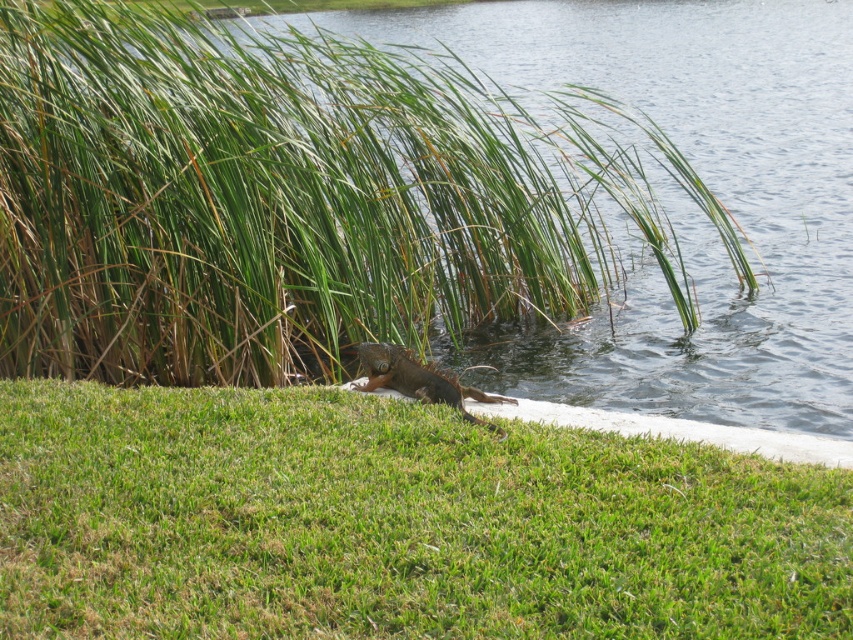
Question: Which point is farther to the camera?

Choices:
 (A) brown scaly lizard at center
 (B) clear water at grass right
 (C) green grassy at lower center

Answer: (B)

Question: Which object is closer to the camera taking this photo?

Choices:
 (A) clear water at grass right
 (B) brown scaly lizard at center

Answer: (B)

Question: Is clear water at grass right to the left of brown scaly lizard at center from the viewer's perspective?

Choices:
 (A) no
 (B) yes

Answer: (A)

Question: Which point is farther to the camera?

Choices:
 (A) green grassy at lower center
 (B) brown scaly lizard at center

Answer: (B)

Question: Can you confirm if clear water at grass right is wider than green grassy at lower center?

Choices:
 (A) no
 (B) yes

Answer: (B)

Question: Can you confirm if clear water at grass right is positioned to the left of brown scaly lizard at center?

Choices:
 (A) yes
 (B) no

Answer: (B)